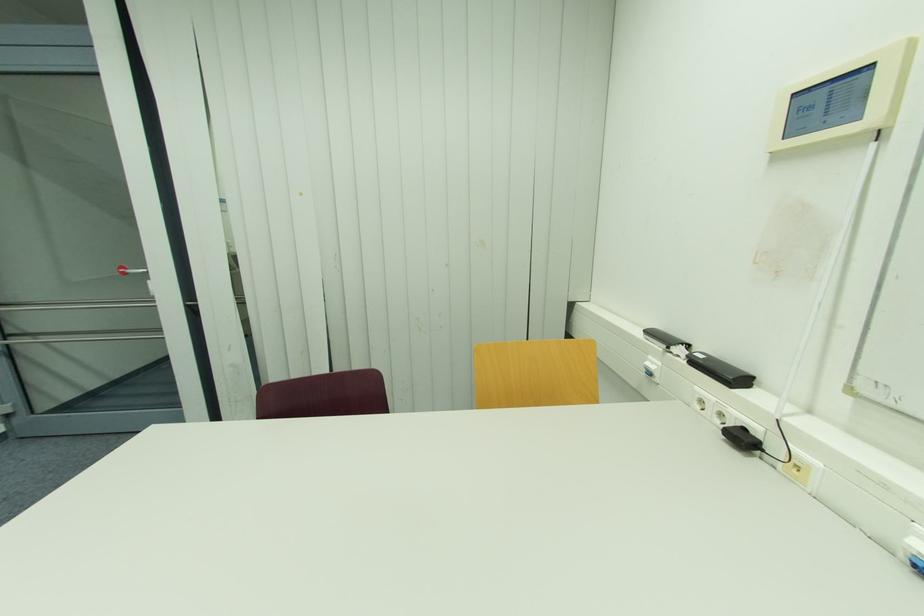
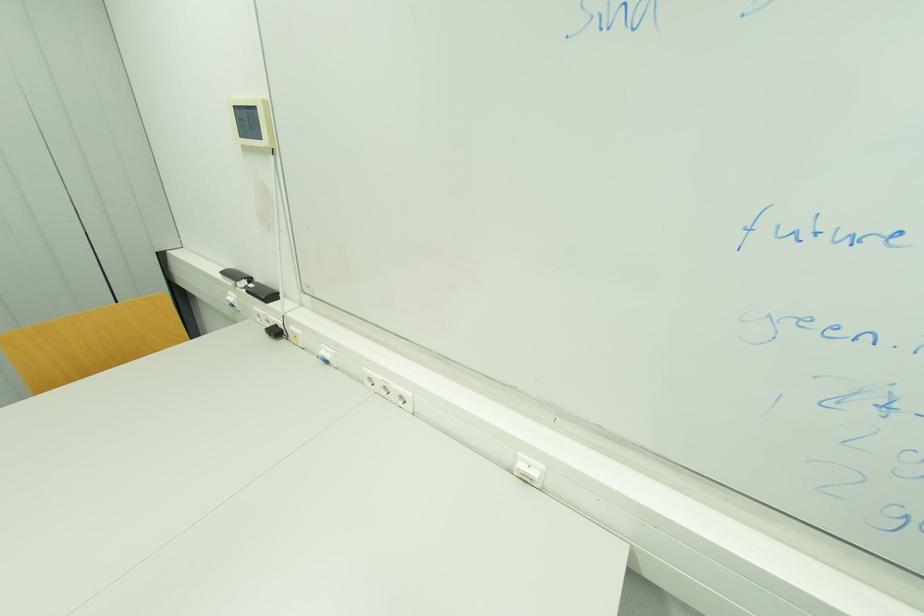
Where in the second image is the point corresponding to point (651, 334) from the first image?

(228, 274)